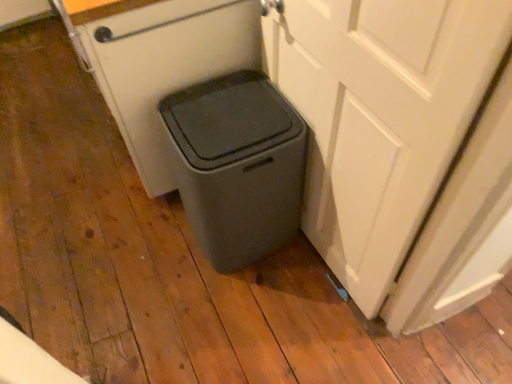
Identify the location of vacant region to the left of matte gray trash can at lower center. (126, 245).